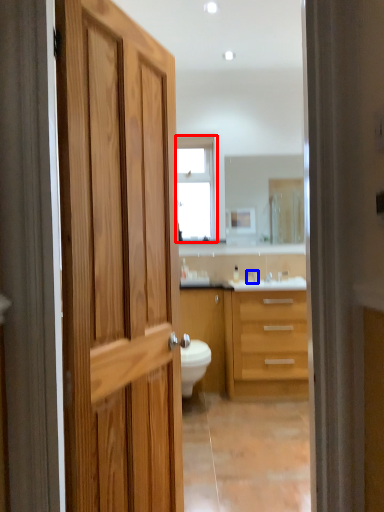
Question: Which of the following is the closest to the observer, window (highlighted by a red box) or faucet (highlighted by a blue box)?

Choices:
 (A) window
 (B) faucet

Answer: (B)